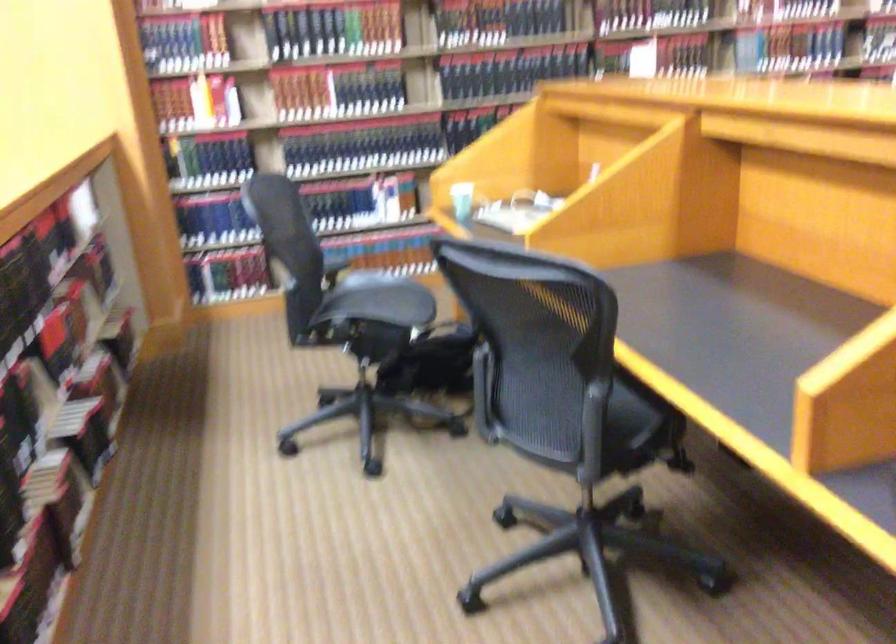
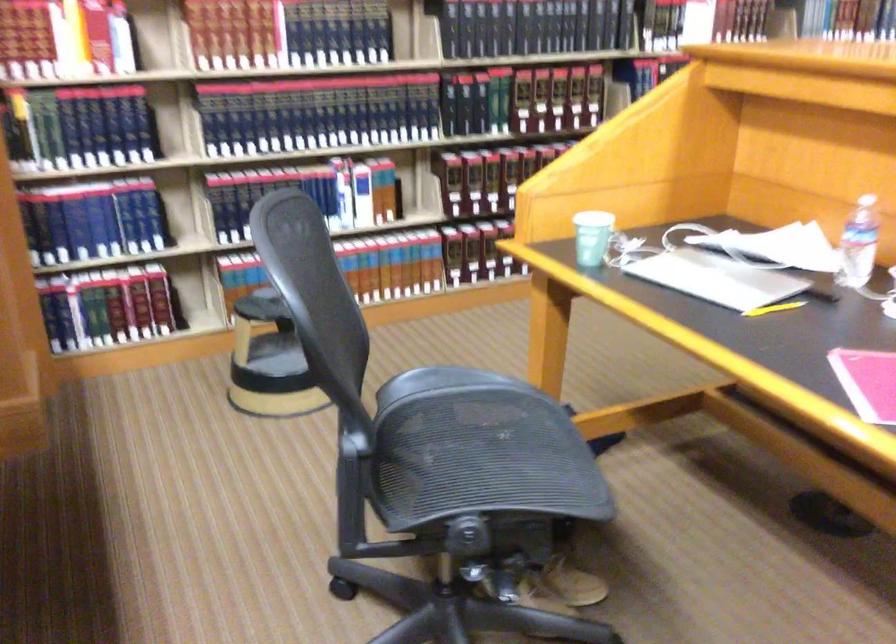
In the second image, find the point that corresponds to point 200,104 in the first image.

(64, 39)